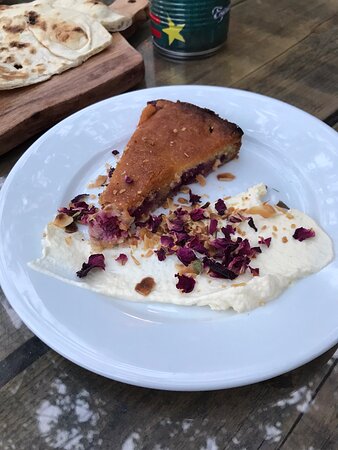
In order to click on wooden table in this screenshot , I will do `click(298, 63)`.